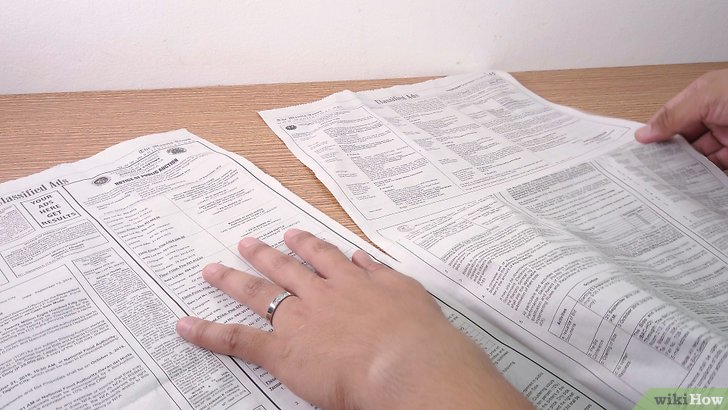
This screenshot has width=728, height=410. What are the coordinates of `table` in the screenshot? It's located at (247, 111).